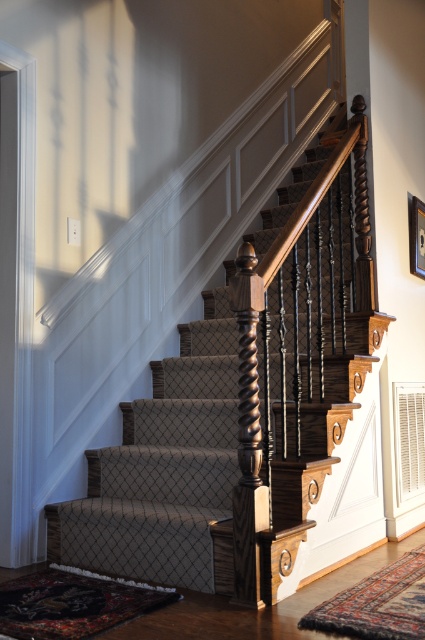
Can you confirm if carpeted stairs at center is wider than wooden picture frame at upper right?

Yes, carpeted stairs at center is wider than wooden picture frame at upper right.

Which of these two, carpeted stairs at center or wooden picture frame at upper right, stands shorter?

wooden picture frame at upper right is shorter.

In order to click on carpeted stairs at center in this screenshot , I will do `click(243, 404)`.